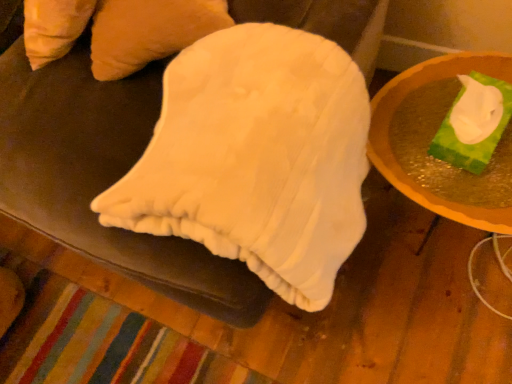
Identify the location of free space to the back side of green matte tissue box at right. The image size is (512, 384). (433, 81).